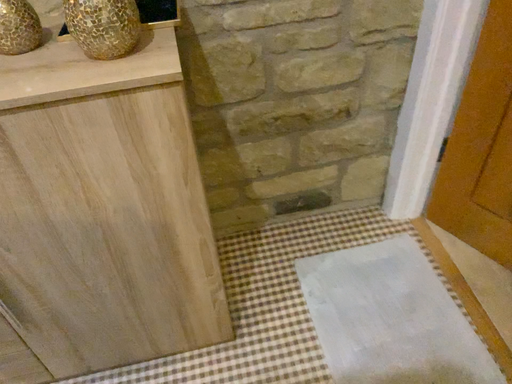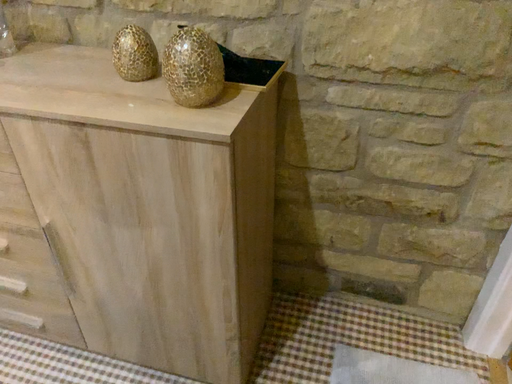
Question: How did the camera likely rotate when shooting the video?

Choices:
 (A) rotated downward
 (B) rotated upward

Answer: (B)